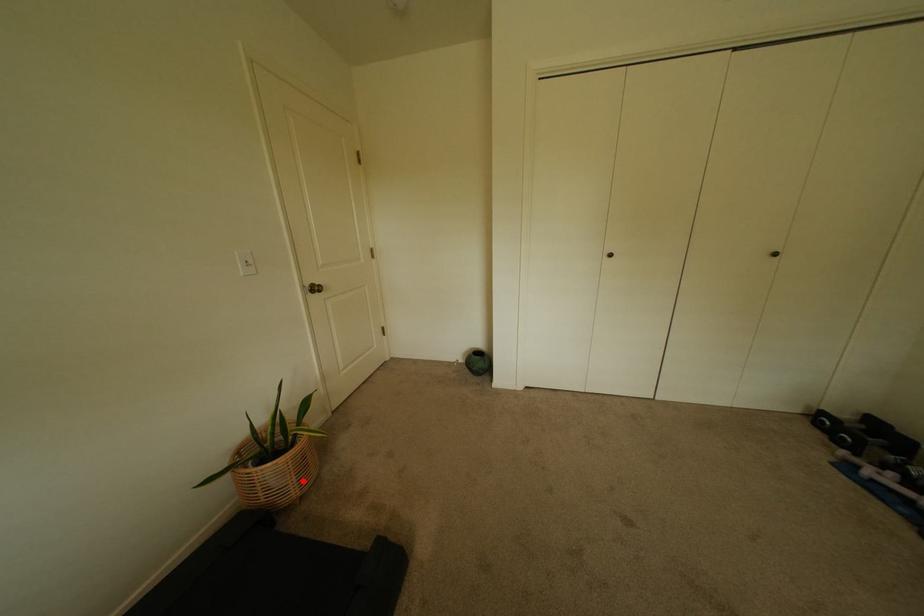
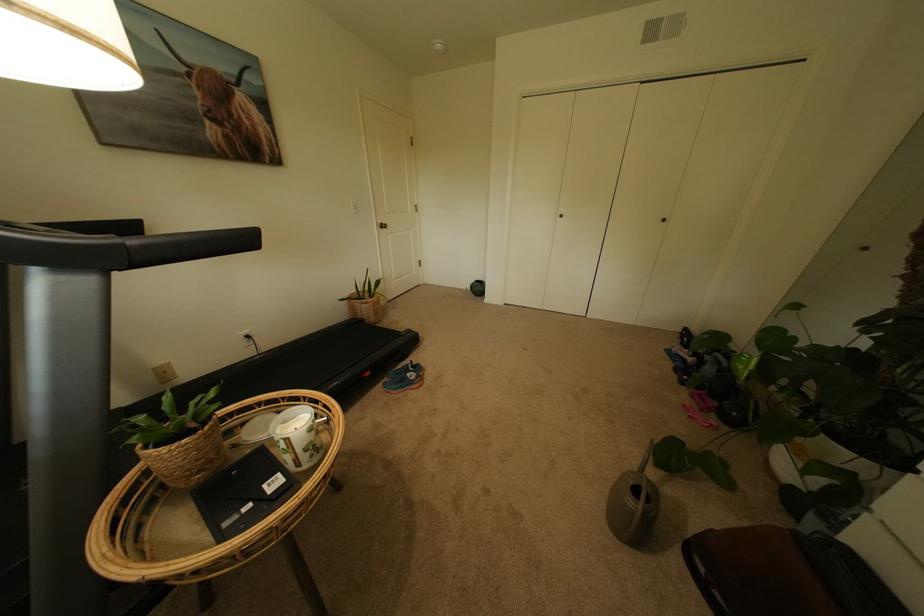
Question: I am providing you with two images of the same scene from different viewpoints. Given a red point in image1, look at the same physical point in image2. Is it:

Choices:
 (A) Closer to the viewpoint
 (B) Farther from the viewpoint

Answer: (A)